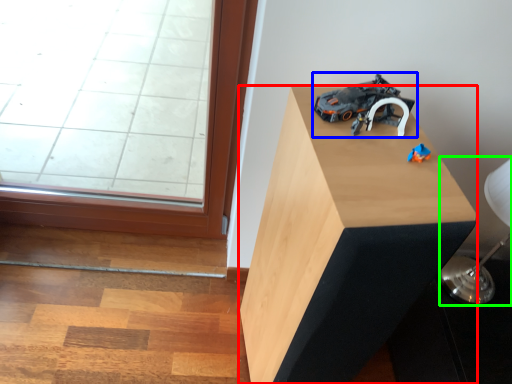
Question: Considering the real-world distances, which object is closest to furniture (highlighted by a red box)? toy (highlighted by a blue box) or table lamp (highlighted by a green box).

Choices:
 (A) toy
 (B) table lamp

Answer: (A)